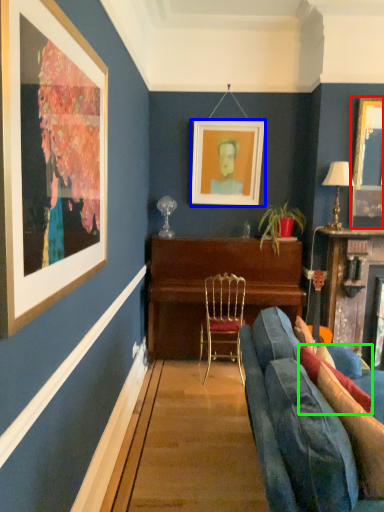
Question: Based on their relative distances, which object is farther from picture frame (highlighted by a red box)? Choose from picture frame (highlighted by a blue box) and pillow (highlighted by a green box).

Choices:
 (A) picture frame
 (B) pillow

Answer: (B)